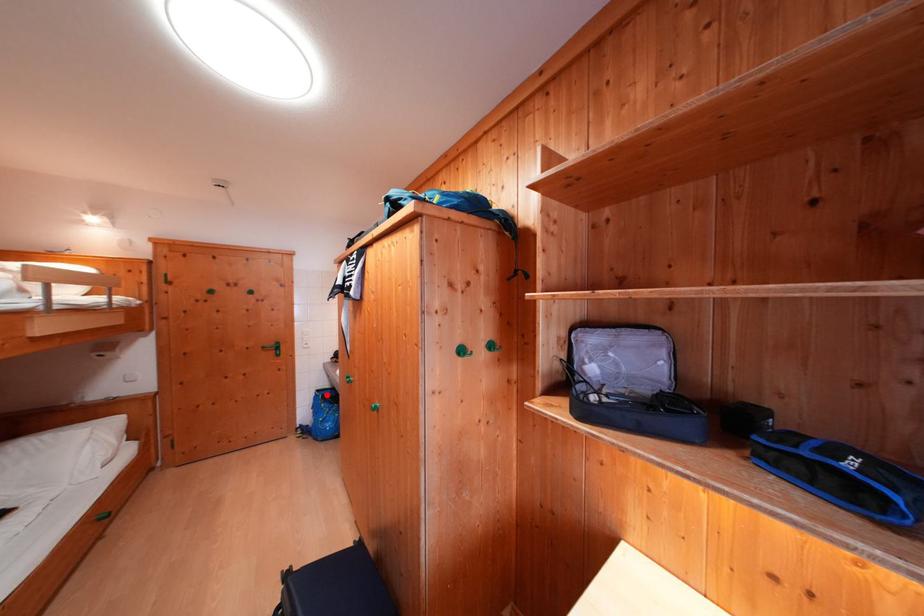
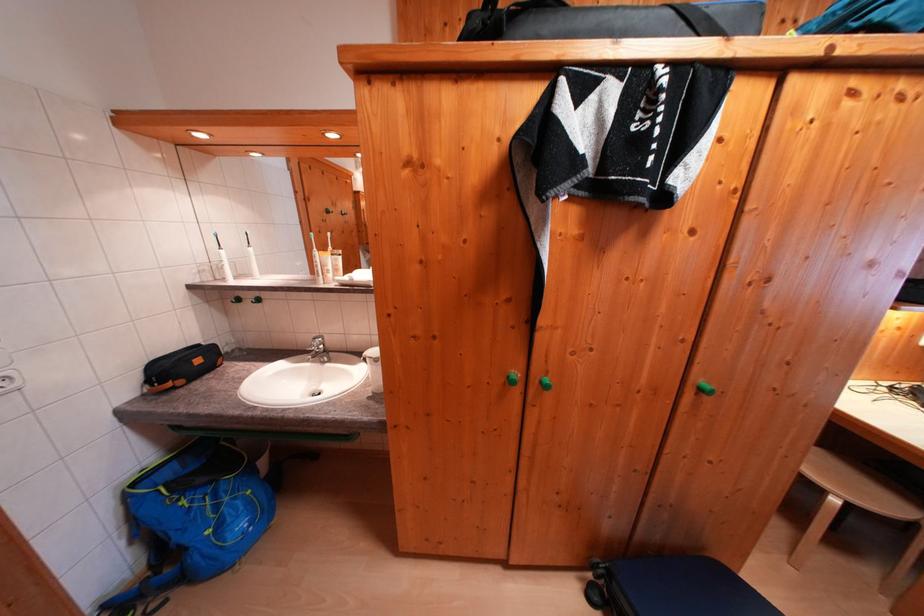
Question: I am providing you with two images of the same scene from different viewpoints. In image1, a red point is highlighted. Considering the same 3D point in image2, which of the following is correct?

Choices:
 (A) It is closer
 (B) It is farther

Answer: (A)